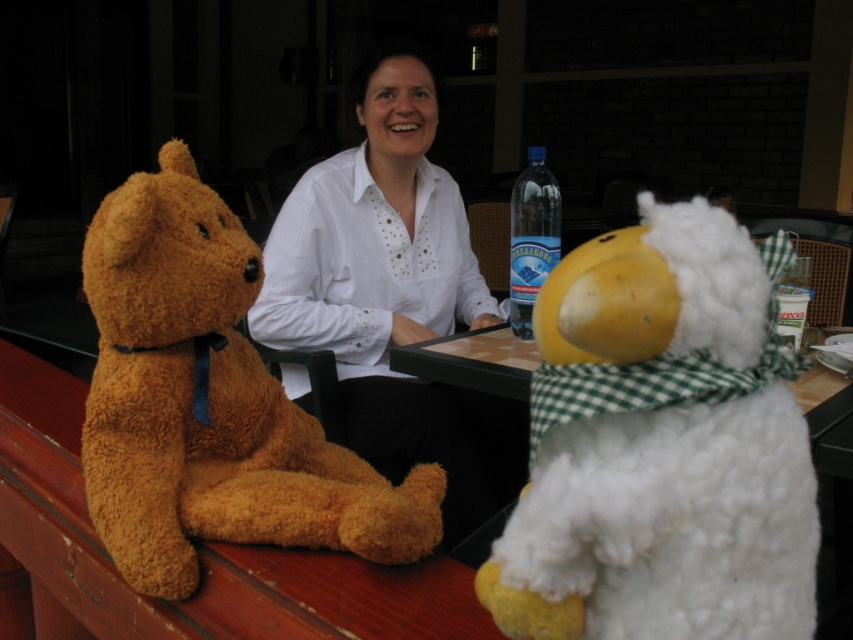
Is white fluffy stuffed animal at right positioned in front of fuzzy brown teddy bear at left?

That is True.

At what (x,y) coordinates should I click in order to perform the action: click on white fluffy stuffed animal at right. Please return your answer as a coordinate pair (x, y). Looking at the image, I should click on (660, 445).

Between point (646, 627) and point (212, 419), which one is positioned in front?

Point (646, 627) is more forward.

This screenshot has width=853, height=640. I want to click on white fluffy stuffed animal at right, so click(x=660, y=445).

Can you confirm if white fluffy stuffed animal at right is positioned below white matte shirt at center?

Yes, white fluffy stuffed animal at right is below white matte shirt at center.

Can you confirm if white fluffy stuffed animal at right is positioned to the left of white matte shirt at center?

No, white fluffy stuffed animal at right is not to the left of white matte shirt at center.

Is point (653, 369) positioned before point (384, 150)?

That is True.

This screenshot has width=853, height=640. What are the coordinates of `white fluffy stuffed animal at right` in the screenshot? It's located at (660, 445).

Does white matte shirt at center have a lesser height compared to blue plastic bottle at upper center?

In fact, white matte shirt at center may be taller than blue plastic bottle at upper center.

Does white matte shirt at center have a lesser width compared to blue plastic bottle at upper center?

No.

Who is more forward, (323, 257) or (538, 234)?

Point (538, 234)

I want to click on white matte shirt at center, so click(390, 292).